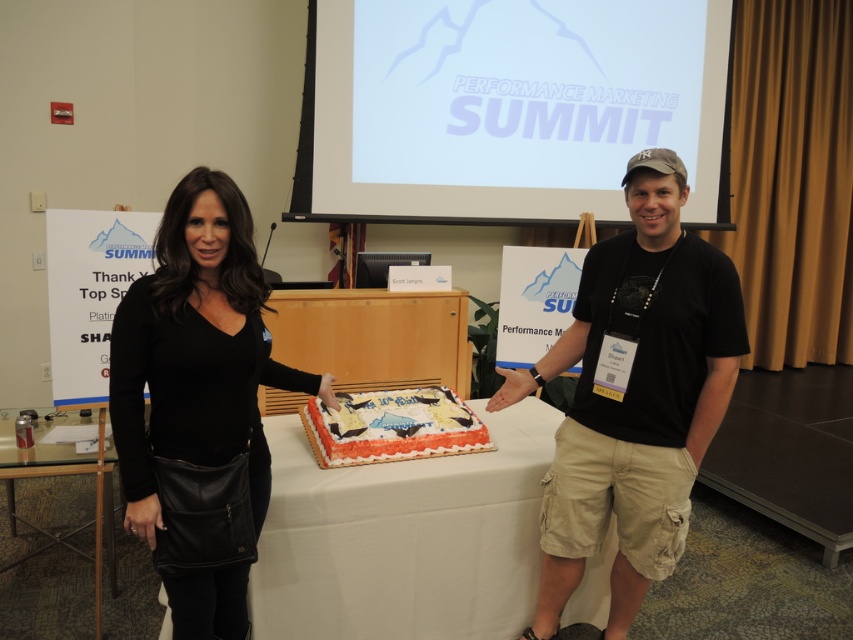
You are standing in the conference room and want to take a photo of the cake. The cake is placed at point (544, 61). If your camera has a focal length of 50mm and you want to capture the entire cake in the frame, which is approximately 30cm tall, what distance should you maintain from the cake to ensure it fits vertically in the frame?

The point (544, 61) is 3.96 meters from the viewer. To capture a 30cm tall cake at this distance with a 50mm lens, you should position yourself approximately 3.96 meters away, as the cake height will fit within the frame considering standard camera framing calculations.